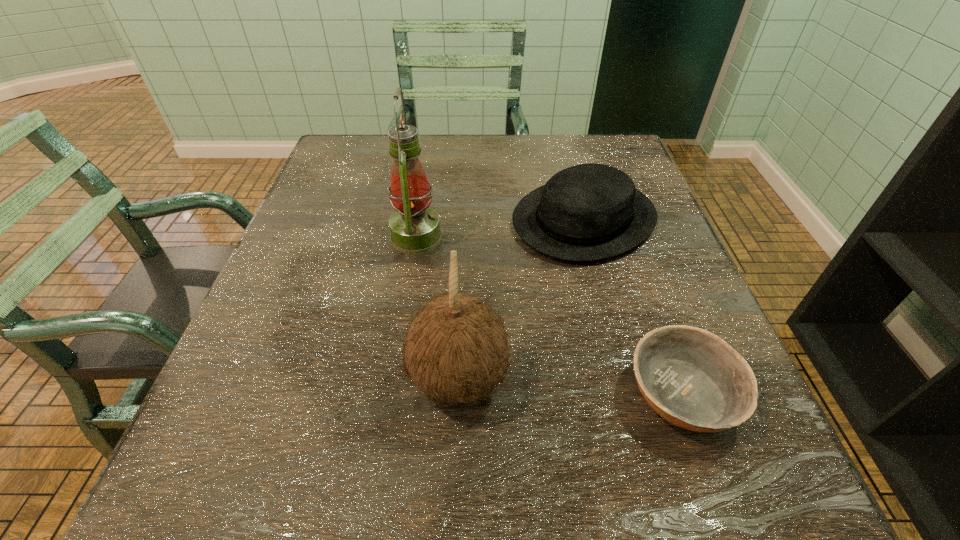
Locate an element on the screen. free space between the fedora and the bowl is located at coordinates (633, 306).

The width and height of the screenshot is (960, 540). I want to click on free space that is in between the oil lamp and the shortest object, so click(x=549, y=315).

Where is `empty space between the fedora and the oil lamp`? The width and height of the screenshot is (960, 540). empty space between the fedora and the oil lamp is located at coordinates (500, 228).

Locate an element on the screen. The height and width of the screenshot is (540, 960). free spot between the tallest object and the fedora is located at coordinates (500, 228).

Identify which object is the second closest to the second shortest object. Please provide its 2D coordinates. Your answer should be formatted as a tuple, i.e. [(x, y)], where the tuple contains the x and y coordinates of a point satisfying the conditions above.

[(456, 351)]

The width and height of the screenshot is (960, 540). In order to click on object that is the second closest one to the shortest object in this screenshot , I will do click(x=588, y=212).

The image size is (960, 540). Find the location of `vacant space that satisfies the following two spatial constraints: 1. on the back side of the bowl; 2. on the surface of the coconut`. vacant space that satisfies the following two spatial constraints: 1. on the back side of the bowl; 2. on the surface of the coconut is located at coordinates (677, 380).

The image size is (960, 540). I want to click on vacant region that satisfies the following two spatial constraints: 1. on the surface of the shortest object; 2. on the right side of the second tallest object, so click(x=459, y=393).

The width and height of the screenshot is (960, 540). I want to click on free spot that satisfies the following two spatial constraints: 1. on the back side of the oil lamp; 2. on the right side of the third tallest object, so click(419, 219).

Where is `blank area in the image that satisfies the following two spatial constraints: 1. on the front side of the fedora; 2. on the surface of the second tallest object`? This screenshot has height=540, width=960. blank area in the image that satisfies the following two spatial constraints: 1. on the front side of the fedora; 2. on the surface of the second tallest object is located at coordinates (628, 380).